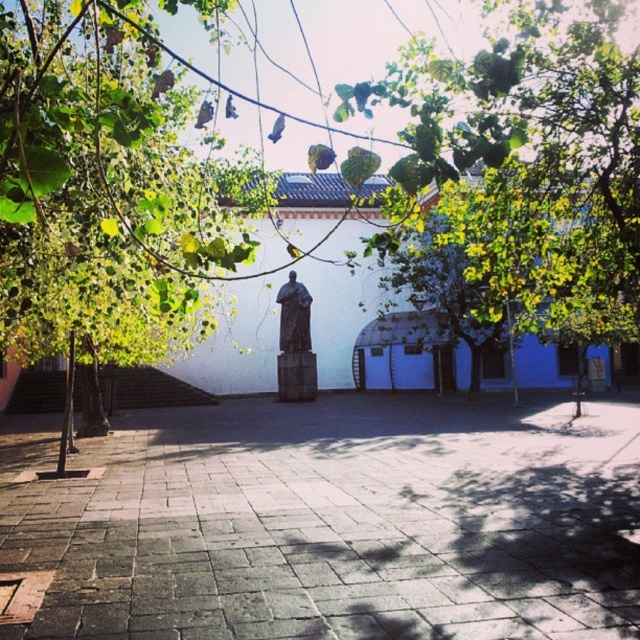
Question: Does gray stone pavement at center appear on the left side of green leafy tree at center?

Choices:
 (A) no
 (B) yes

Answer: (B)

Question: Among these objects, which one is farthest from the camera?

Choices:
 (A) gray stone pavement at center
 (B) green leafy tree at center

Answer: (A)

Question: Does gray stone pavement at center appear under green leafy tree at center?

Choices:
 (A) no
 (B) yes

Answer: (B)

Question: Which point is farther from the camera taking this photo?

Choices:
 (A) (428, 621)
 (B) (284, 324)

Answer: (B)

Question: Among these points, which one is farthest from the camera?

Choices:
 (A) (298, 323)
 (B) (360, 104)

Answer: (A)

Question: Is gray stone pavement at center further to the viewer compared to bronze statue at center?

Choices:
 (A) no
 (B) yes

Answer: (A)